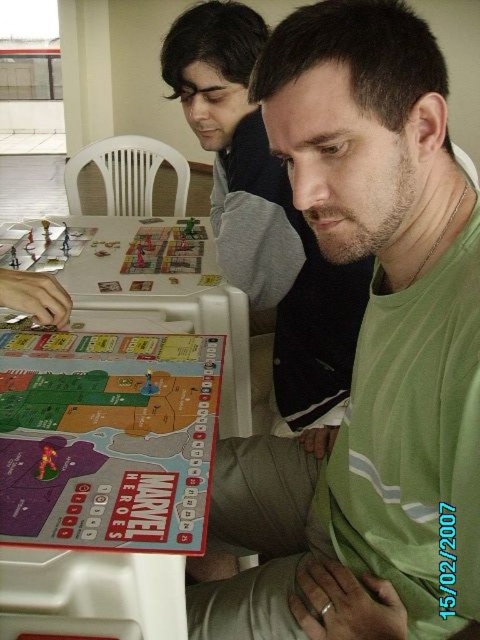
You are a photographer taking a picture of the scene. You want to ensure both the green matte shirt at center and the matte plastic board game at left are clearly visible. Based on their positions, which object should you focus on first to capture both in the frame?

The green matte shirt at center is to the right of the matte plastic board game at left. Since the photographer wants both in focus, they should focus on the matte plastic board game at left first as it is closer to the left edge, ensuring the shirt at center remains within the frame.

You are a photographer trying to capture a clear shot of the green matte shirt at center and the matte plastic board game at left. Since you want to focus on both objects equally, which one should you adjust your camera focus to prioritize based on their sizes?

The green matte shirt at center is larger in size than the matte plastic board game at left, so you should prioritize focusing on the green matte shirt at center to ensure both are in focus.